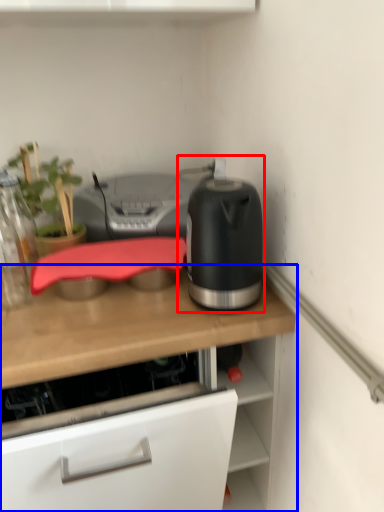
Question: Among these objects, which one is nearest to the camera, kitchen appliance (highlighted by a red box) or countertop (highlighted by a blue box)?

Choices:
 (A) kitchen appliance
 (B) countertop

Answer: (B)